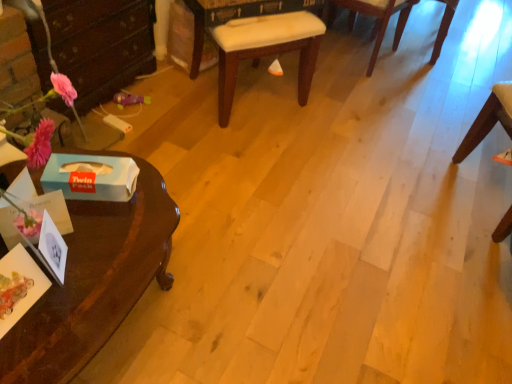
Where is `free space to the right of white cardboard box at lower left, the 2th box when ordered from front to back`? The width and height of the screenshot is (512, 384). free space to the right of white cardboard box at lower left, the 2th box when ordered from front to back is located at coordinates (143, 207).